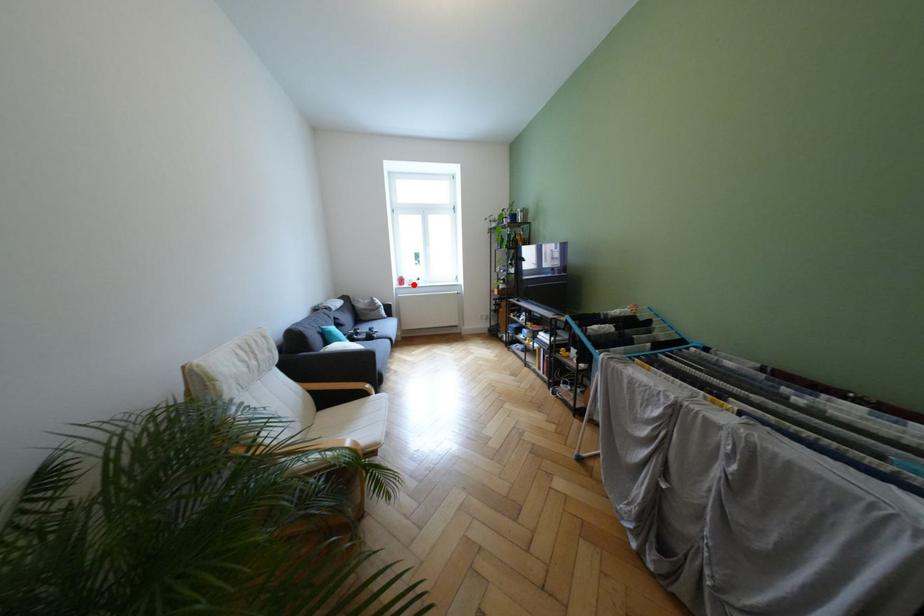
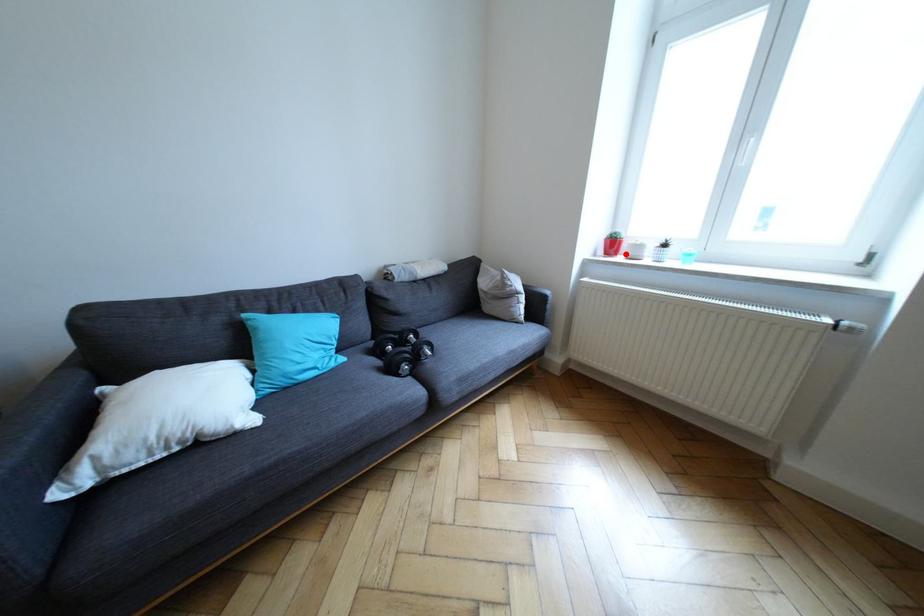
I am providing you with two images of the same scene from different viewpoints. A red point is marked on the first image and another point is marked on the second image. Does the point marked in image1 correspond to the same location as the one in image2?

Yes